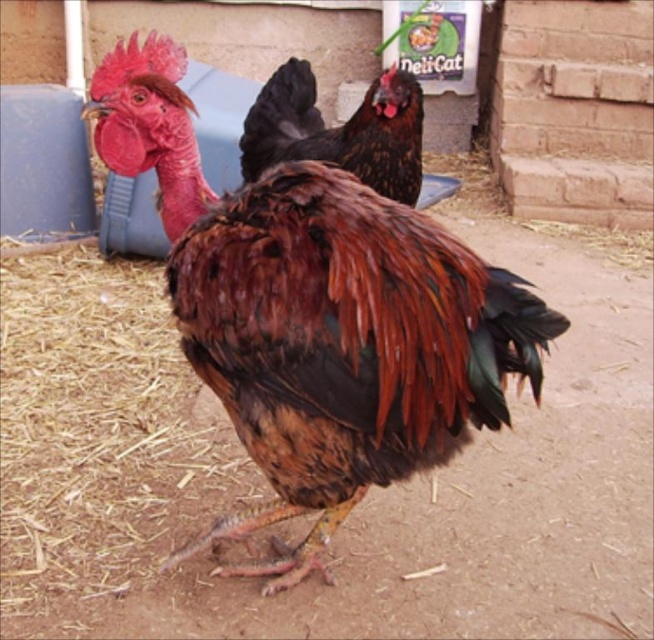
You are a farmer checking on your chickens. You notice the brown feathered chicken at center and the shiny black feathers at center. Which chicken is taller?

The brown feathered chicken at center is taller than the shiny black feathers at center.

From the picture: You are a farmer looking at the two chickens in the farmyard. You notice the brown feathered chicken at center and the shiny black feathers at center. Which chicken is positioned closer to the left side of the scene?

The brown feathered chicken at center is positioned closer to the left side of the scene because it is to the left of the shiny black feathers at center.